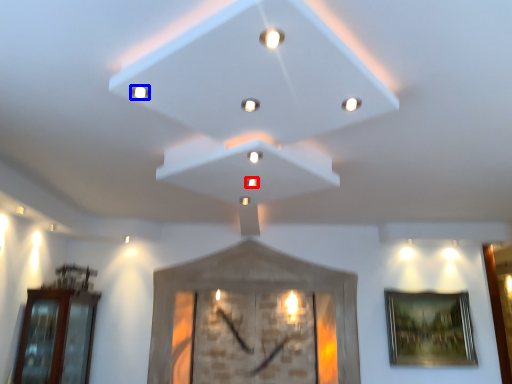
Question: Which object is closer to the camera taking this photo, light (highlighted by a red box) or light (highlighted by a blue box)?

Choices:
 (A) light
 (B) light

Answer: (B)